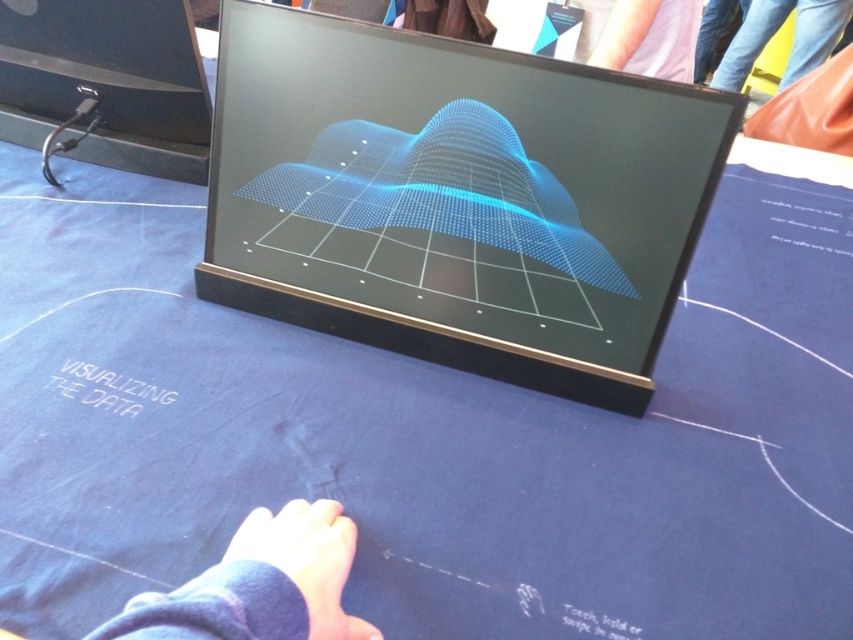
You are at a tech exhibition and see the display setup. You need to place a small device on the table. The device must be placed somewhere not covered by the skinny blue fabric at lower center or the jeans at upper right. Where should you put it?

You should place the small device on the table area that is neither covered by the skinny blue fabric at lower center nor the jeans at upper right. Since the skinny blue fabric at lower center is below the jeans at upper right, the device can be placed in the remaining uncovered area of the table.

You are setting up a presentation and need to place both the matte black laptop at center and the skinny blue fabric at lower center on the table. Based on their sizes, which object should you place first to ensure they both fit on the table?

The matte black laptop at center is wider than the skinny blue fabric at lower center. Therefore, you should place the matte black laptop at center first to accommodate its larger width before positioning the skinny blue fabric at lower center.